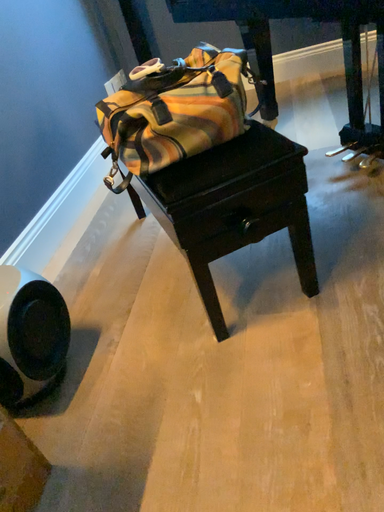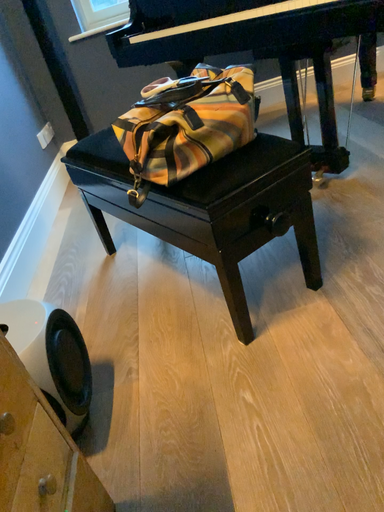
Question: Which way did the camera rotate in the video?

Choices:
 (A) rotated right
 (B) rotated left

Answer: (A)